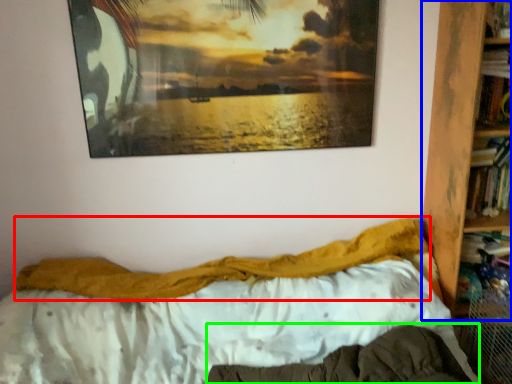
Question: Which is farther away from blanket (highlighted by a red box)? bookcase (highlighted by a blue box) or mattress (highlighted by a green box)?

Choices:
 (A) bookcase
 (B) mattress

Answer: (A)